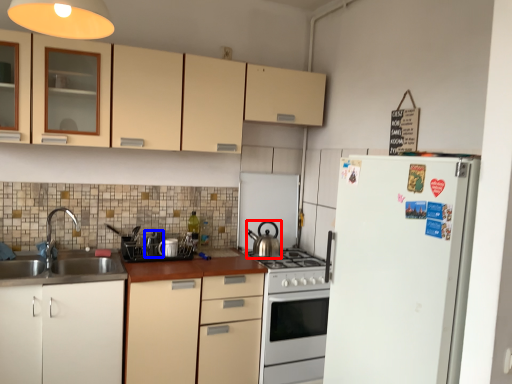
Question: Which object is further to the camera taking this photo, kitchen appliance (highlighted by a red box) or appliance (highlighted by a blue box)?

Choices:
 (A) kitchen appliance
 (B) appliance

Answer: (A)